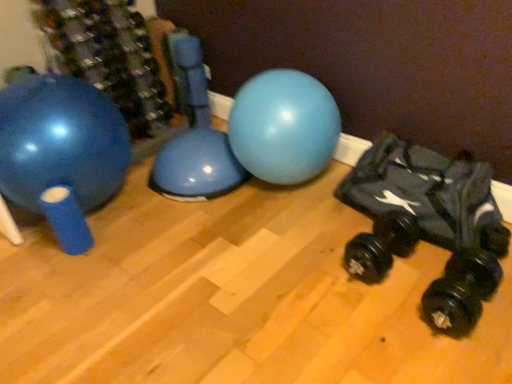
Image resolution: width=512 pixels, height=384 pixels. What do you see at coordinates (381, 247) in the screenshot?
I see `black rubber dumbbell at lower right, acting as the second dumbbell starting from the right` at bounding box center [381, 247].

Image resolution: width=512 pixels, height=384 pixels. I want to click on black rubber dumbbell at lower right, acting as the second dumbbell starting from the right, so click(x=381, y=247).

Between black rubber dumbbell at lower right, arranged as the first dumbbell when viewed from the left, and black rubber dumbbell at lower right, the 1th dumbbell when ordered from right to left, which one has smaller width?

With smaller width is black rubber dumbbell at lower right, the 1th dumbbell when ordered from right to left.

From a real-world perspective, is black rubber dumbbell at lower right, acting as the second dumbbell starting from the right, physically located above or below black rubber dumbbell at lower right, which is counted as the second dumbbell, starting from the left?

In terms of real-world spatial position, black rubber dumbbell at lower right, acting as the second dumbbell starting from the right, is below black rubber dumbbell at lower right, which is counted as the second dumbbell, starting from the left.

Does black rubber dumbbell at lower right, arranged as the first dumbbell when viewed from the left, have a smaller size compared to black rubber dumbbell at lower right, the 1th dumbbell when ordered from right to left?

No.

Does point (397, 213) appear closer or farther from the camera than point (461, 332)?

Point (397, 213) is positioned farther from the camera compared to point (461, 332).

From the image's perspective, between black rubber dumbbell at lower right, which is counted as the second dumbbell, starting from the left, and matte blue exercise ball at left, who is located below?

From the image's view, black rubber dumbbell at lower right, which is counted as the second dumbbell, starting from the left, is below.

Is black rubber dumbbell at lower right, the 1th dumbbell when ordered from right to left, facing towards matte blue exercise ball at left?

No, black rubber dumbbell at lower right, the 1th dumbbell when ordered from right to left, is not oriented towards matte blue exercise ball at left.

From the image's perspective, count 2nd dumbbells downward from the matte blue exercise ball at left and point to it. Please provide its 2D coordinates.

[(461, 291)]

Considering the positions of points (464, 315) and (83, 182), is point (464, 315) closer to camera compared to point (83, 182)?

Yes, it is.

Between black rubber dumbbell at lower right, acting as the second dumbbell starting from the right, and matte blue exercise ball at left, which one has less height?

black rubber dumbbell at lower right, acting as the second dumbbell starting from the right.

How different are the orientations of black rubber dumbbell at lower right, arranged as the first dumbbell when viewed from the left, and matte blue exercise ball at left in degrees?

The angle between the facing direction of black rubber dumbbell at lower right, arranged as the first dumbbell when viewed from the left, and the facing direction of matte blue exercise ball at left is 85.8 degrees.

From a real-world perspective, is black rubber dumbbell at lower right, arranged as the first dumbbell when viewed from the left, on matte blue exercise ball at left?

No.

Is black rubber dumbbell at lower right, acting as the second dumbbell starting from the right, facing towards matte blue exercise ball at left?

No, black rubber dumbbell at lower right, acting as the second dumbbell starting from the right, does not turn towards matte blue exercise ball at left.

Find the location of a particular element. This screenshot has height=384, width=512. the 1st dumbbell to the right of the matte blue exercise ball at left, starting your count from the anchor is located at coordinates (381, 247).

Measure the distance between matte blue exercise ball at left and black rubber dumbbell at lower right, arranged as the first dumbbell when viewed from the left.

matte blue exercise ball at left and black rubber dumbbell at lower right, arranged as the first dumbbell when viewed from the left, are 1.34 meters apart.

Consider the image. Can you confirm if matte blue exercise ball at left is positioned to the right of black rubber dumbbell at lower right, arranged as the first dumbbell when viewed from the left?

No, matte blue exercise ball at left is not to the right of black rubber dumbbell at lower right, arranged as the first dumbbell when viewed from the left.

From a real-world perspective, who is located lower, matte blue exercise ball at left or black rubber dumbbell at lower right, acting as the second dumbbell starting from the right?

black rubber dumbbell at lower right, acting as the second dumbbell starting from the right, from a real-world perspective.

Is there a large distance between black rubber dumbbell at lower right, the 1th dumbbell when ordered from right to left, and black rubber dumbbell at lower right, acting as the second dumbbell starting from the right?

No, black rubber dumbbell at lower right, the 1th dumbbell when ordered from right to left, is not far from black rubber dumbbell at lower right, acting as the second dumbbell starting from the right.

How distant is black rubber dumbbell at lower right, the 1th dumbbell when ordered from right to left, from black rubber dumbbell at lower right, acting as the second dumbbell starting from the right?

A distance of 10.46 inches exists between black rubber dumbbell at lower right, the 1th dumbbell when ordered from right to left, and black rubber dumbbell at lower right, acting as the second dumbbell starting from the right.

Considering the relative sizes of black rubber dumbbell at lower right, the 1th dumbbell when ordered from right to left, and black rubber dumbbell at lower right, acting as the second dumbbell starting from the right, in the image provided, is black rubber dumbbell at lower right, the 1th dumbbell when ordered from right to left, shorter than black rubber dumbbell at lower right, acting as the second dumbbell starting from the right,?

Incorrect, the height of black rubber dumbbell at lower right, the 1th dumbbell when ordered from right to left, does not fall short of that of black rubber dumbbell at lower right, acting as the second dumbbell starting from the right.

From the image's perspective, does black rubber dumbbell at lower right, which is counted as the second dumbbell, starting from the left, appear higher than black rubber dumbbell at lower right, arranged as the first dumbbell when viewed from the left?

No.

In terms of width, does matte blue exercise ball at left look wider or thinner when compared to black rubber dumbbell at lower right, the 1th dumbbell when ordered from right to left?

matte blue exercise ball at left is wider than black rubber dumbbell at lower right, the 1th dumbbell when ordered from right to left.

Would you say matte blue exercise ball at left is to the left or to the right of black rubber dumbbell at lower right, which is counted as the second dumbbell, starting from the left, in the picture?

Clearly, matte blue exercise ball at left is on the left of black rubber dumbbell at lower right, which is counted as the second dumbbell, starting from the left, in the image.

From a real-world perspective, does matte blue exercise ball at left stand above black rubber dumbbell at lower right, the 1th dumbbell when ordered from right to left?

Indeed, from a real-world perspective, matte blue exercise ball at left stands above black rubber dumbbell at lower right, the 1th dumbbell when ordered from right to left.

Which is closer, (93, 178) or (482, 263)?

Point (93, 178).

You are a GUI agent. You are given a task and a screenshot of the screen. Output one action in this format:
    pyautogui.click(x=<x>, y=<y>)
    Task: Click on the dumbbell that appears above the black rubber dumbbell at lower right, which is counted as the second dumbbell, starting from the left (from the image's perspective)
    This screenshot has height=384, width=512.
    Given the screenshot: What is the action you would take?
    pyautogui.click(x=381, y=247)

Where is `the 1st dumbbell positioned below the matte blue exercise ball at left (from a real-world perspective)`? This screenshot has width=512, height=384. the 1st dumbbell positioned below the matte blue exercise ball at left (from a real-world perspective) is located at coordinates pyautogui.click(x=461, y=291).

Estimate the real-world distances between objects in this image. Which object is further from black rubber dumbbell at lower right, the 1th dumbbell when ordered from right to left, black rubber dumbbell at lower right, acting as the second dumbbell starting from the right, or matte blue exercise ball at left?

matte blue exercise ball at left.

Which object lies further to the anchor point black rubber dumbbell at lower right, which is counted as the second dumbbell, starting from the left, matte blue exercise ball at left or black rubber dumbbell at lower right, arranged as the first dumbbell when viewed from the left?

matte blue exercise ball at left is further to black rubber dumbbell at lower right, which is counted as the second dumbbell, starting from the left.

Looking at the image, which one is located closer to matte blue exercise ball at left, black rubber dumbbell at lower right, the 1th dumbbell when ordered from right to left, or black rubber dumbbell at lower right, acting as the second dumbbell starting from the right?

black rubber dumbbell at lower right, acting as the second dumbbell starting from the right, is closer to matte blue exercise ball at left.

When comparing their distances from matte blue exercise ball at left, does black rubber dumbbell at lower right, acting as the second dumbbell starting from the right, or black rubber dumbbell at lower right, the 1th dumbbell when ordered from right to left, seem further?

black rubber dumbbell at lower right, the 1th dumbbell when ordered from right to left.

Which object lies nearer to the anchor point black rubber dumbbell at lower right, acting as the second dumbbell starting from the right, black rubber dumbbell at lower right, the 1th dumbbell when ordered from right to left, or matte blue exercise ball at left?

Among the two, black rubber dumbbell at lower right, the 1th dumbbell when ordered from right to left, is located nearer to black rubber dumbbell at lower right, acting as the second dumbbell starting from the right.

From the picture: When comparing their distances from black rubber dumbbell at lower right, arranged as the first dumbbell when viewed from the left, does matte blue exercise ball at left or black rubber dumbbell at lower right, the 1th dumbbell when ordered from right to left, seem closer?

black rubber dumbbell at lower right, the 1th dumbbell when ordered from right to left, lies closer to black rubber dumbbell at lower right, arranged as the first dumbbell when viewed from the left, than the other object.

Where is `dumbbell between matte blue exercise ball at left and black rubber dumbbell at lower right, the 1th dumbbell when ordered from right to left`? dumbbell between matte blue exercise ball at left and black rubber dumbbell at lower right, the 1th dumbbell when ordered from right to left is located at coordinates (381, 247).